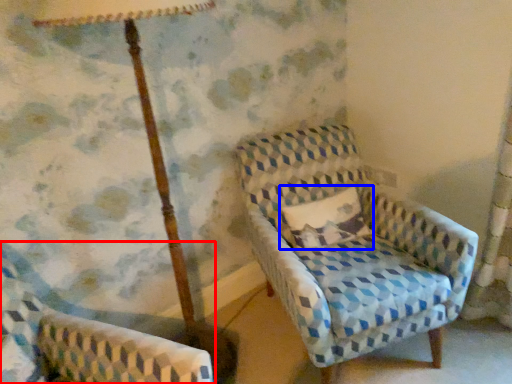
Question: Which point is further to the camera, chair (highlighted by a red box) or pillow (highlighted by a blue box)?

Choices:
 (A) chair
 (B) pillow

Answer: (B)